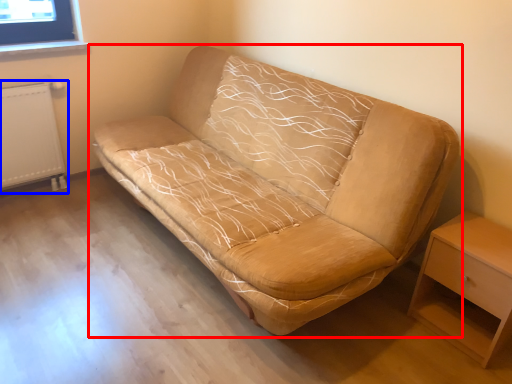
Question: Which object appears farthest to the camera in this image, studio couch (highlighted by a red box) or radiator (highlighted by a blue box)?

Choices:
 (A) studio couch
 (B) radiator

Answer: (B)